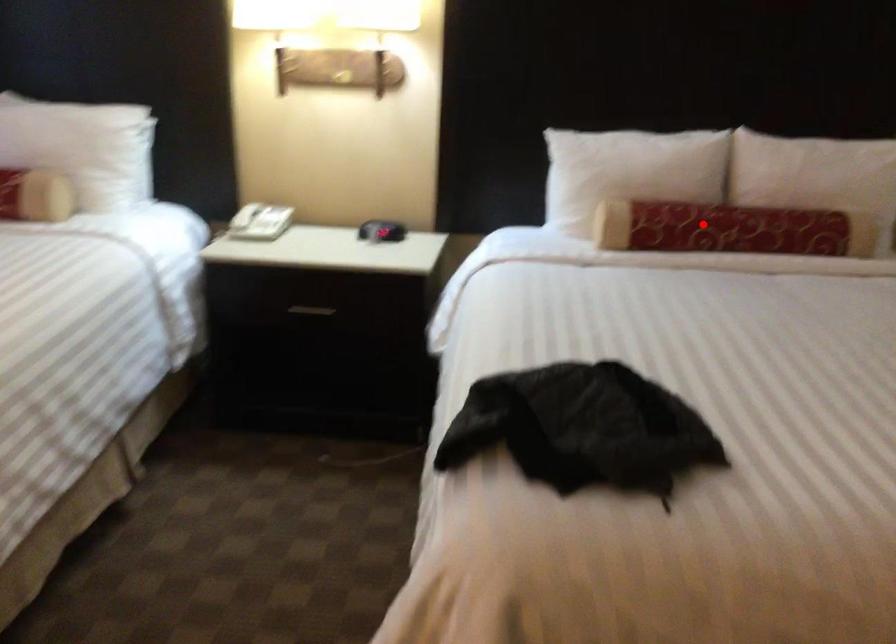
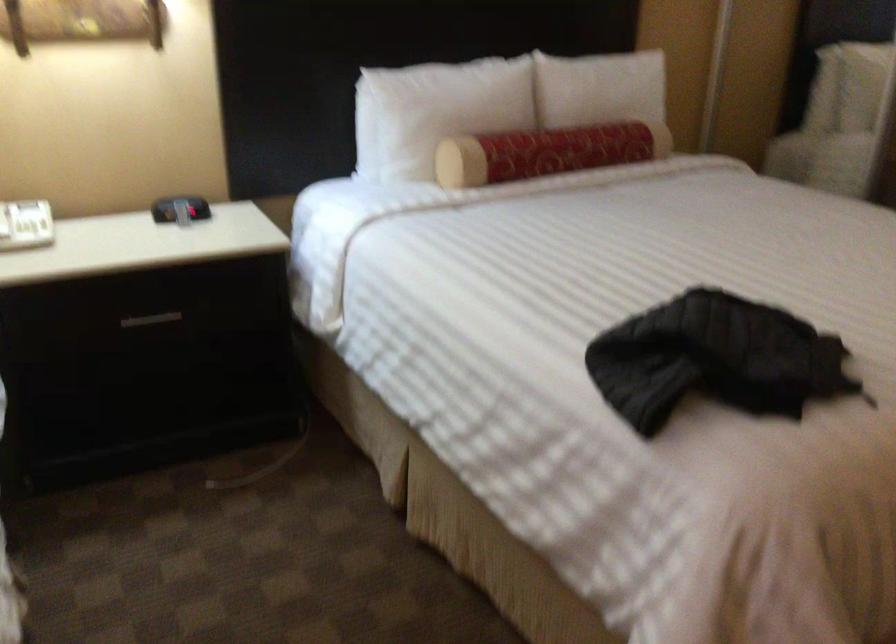
Locate, in the second image, the point that corresponds to the highlighted location in the first image.

(546, 152)